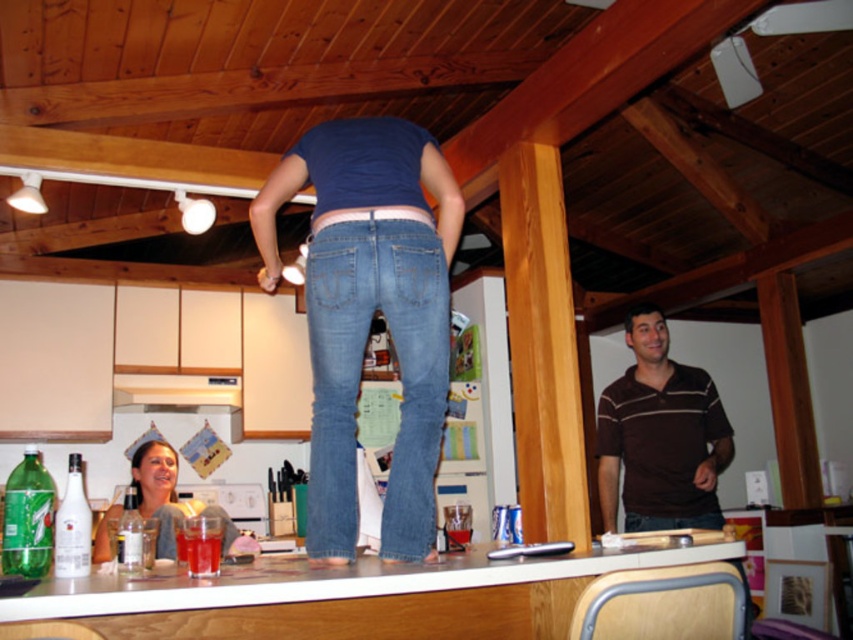
You are a delivery robot with a package that needs to be placed between the white laminate counter at center and the denim at center. The package is 15 inches long. Will it fit in the space between them?

The distance between the white laminate counter at center and the denim at center is 16.30 inches. Since the package is 15 inches long, it will fit in the space between them as there is enough room.

You are a person standing in the kitchen and want to place a large plate on the white laminate counter at center. Can you place it directly under the white glossy exhaust hood at center?

The white laminate counter at center is below the white glossy exhaust hood at center, so yes, you can place the large plate directly under the white glossy exhaust hood at center.